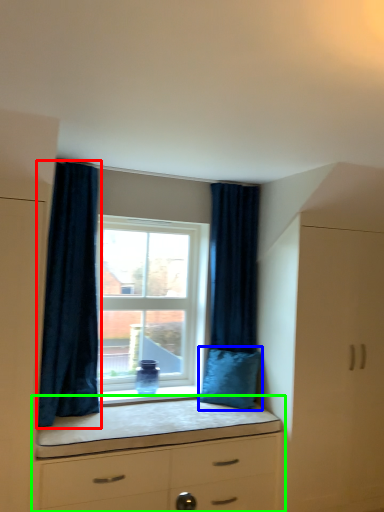
Question: Estimate the real-world distances between objects in this image. Which object is farther from curtain (highlighted by a red box), pillow (highlighted by a blue box) or chest of drawers (highlighted by a green box)?

Choices:
 (A) pillow
 (B) chest of drawers

Answer: (A)